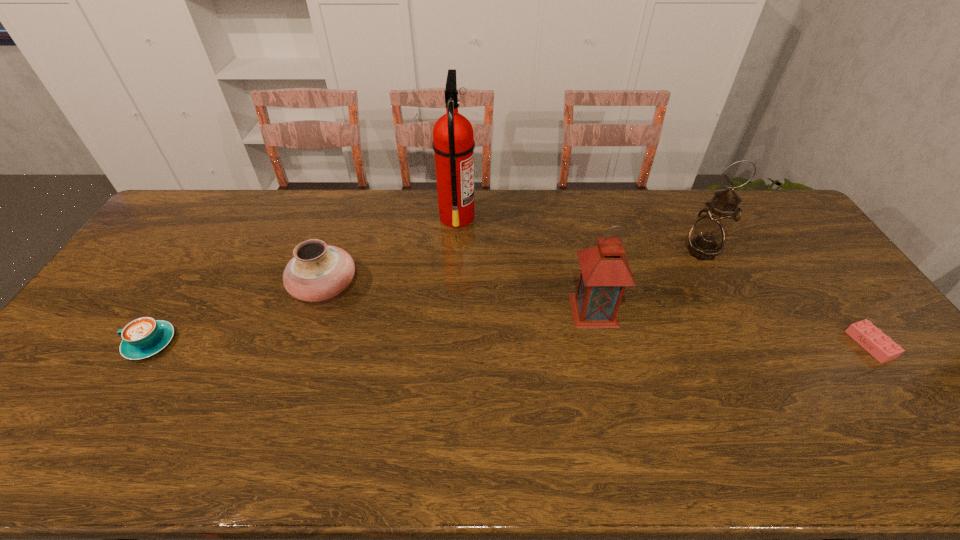
Locate an element on the screen. This screenshot has width=960, height=540. the third object from left to right is located at coordinates (453, 143).

The height and width of the screenshot is (540, 960). I want to click on fire extinguisher, so click(453, 143).

Locate an element on the screen. the second farthest object is located at coordinates (707, 237).

Identify the location of oil lamp. Image resolution: width=960 pixels, height=540 pixels. (707, 237).

Identify the location of lantern. The height and width of the screenshot is (540, 960). (605, 272).

Where is `the third shortest object`? Image resolution: width=960 pixels, height=540 pixels. the third shortest object is located at coordinates (318, 271).

Locate an element on the screen. This screenshot has height=540, width=960. pottery is located at coordinates (318, 271).

At what (x,y) coordinates should I click in order to perform the action: click on the leftmost object. Please return your answer as a coordinate pair (x, y). Looking at the image, I should click on (143, 337).

Where is `cappuccino`? Image resolution: width=960 pixels, height=540 pixels. cappuccino is located at coordinates (143, 337).

This screenshot has height=540, width=960. Identify the location of the rightmost object. (872, 339).